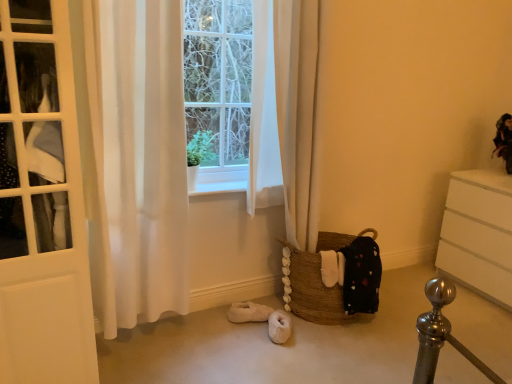
What are the coordinates of `vacant point to the right of brown woven basket at lower center` in the screenshot? It's located at (407, 309).